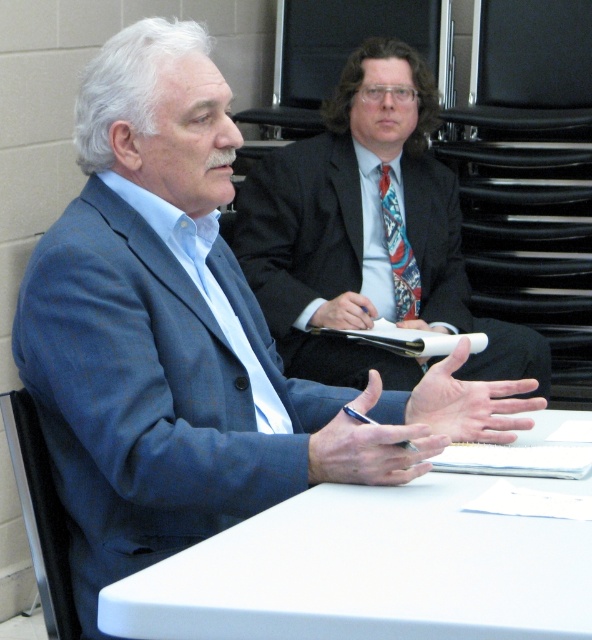
Who is lower down, dark blue wool suit at center or multicolored woven tie at center?

dark blue wool suit at center is below.

Who is higher up, dark blue wool suit at center or multicolored woven tie at center?

multicolored woven tie at center

Is point (259, 192) farther from viewer compared to point (398, 216)?

No.

Identify the location of dark blue wool suit at center. (310, 257).

Which is behind, point (458, 502) or point (401, 232)?

The point (401, 232) is more distant.

Can you confirm if white plastic table at center is wider than multicolored woven tie at center?

Indeed, white plastic table at center has a greater width compared to multicolored woven tie at center.

Does point (493, 573) come closer to viewer compared to point (413, 317)?

Yes, point (493, 573) is in front of point (413, 317).

This screenshot has width=592, height=640. I want to click on white plastic table at center, so [371, 570].

Who is positioned more to the right, white plastic table at center or dark blue wool suit at center?

Positioned to the right is dark blue wool suit at center.

The height and width of the screenshot is (640, 592). What are the coordinates of `white plastic table at center` in the screenshot? It's located at (371, 570).

Locate an element on the screen. The image size is (592, 640). white plastic table at center is located at coordinates (371, 570).